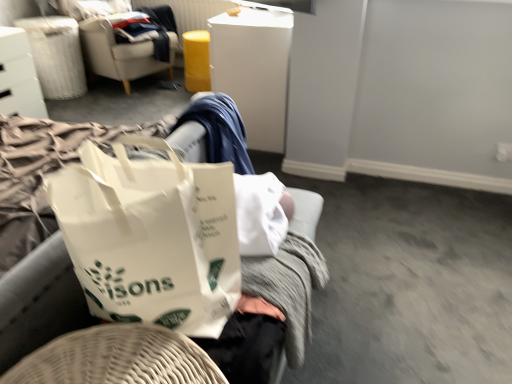
Question: Is white plastic file cabinet at upper center behind white glossy drawer at upper left, arranged as the 2th furniture when ordered from the bottom?

Choices:
 (A) no
 (B) yes

Answer: (A)

Question: Does white plastic file cabinet at upper center turn towards white glossy drawer at upper left, which appears as the 1th furniture when viewed from the left?

Choices:
 (A) yes
 (B) no

Answer: (A)

Question: Is white plastic file cabinet at upper center looking in the opposite direction of white glossy drawer at upper left, arranged as the 2th furniture when viewed from the front?

Choices:
 (A) yes
 (B) no

Answer: (B)

Question: Could white glossy drawer at upper left, the 2th furniture when ordered from right to left, be considered to be inside white plastic file cabinet at upper center?

Choices:
 (A) no
 (B) yes

Answer: (A)

Question: From the image's perspective, is white plastic file cabinet at upper center under white glossy drawer at upper left, the first furniture positioned from the back?

Choices:
 (A) yes
 (B) no

Answer: (B)

Question: Is beige fabric chair at upper left situated inside white fabric laundry basket at upper left or outside?

Choices:
 (A) inside
 (B) outside

Answer: (B)

Question: From a real-world perspective, is beige fabric chair at upper left positioned above or below white fabric laundry basket at upper left?

Choices:
 (A) above
 (B) below

Answer: (A)

Question: Looking at the image, does beige fabric chair at upper left seem bigger or smaller compared to white fabric laundry basket at upper left?

Choices:
 (A) big
 (B) small

Answer: (A)

Question: From their relative heights in the image, would you say beige fabric chair at upper left is taller or shorter than white fabric laundry basket at upper left?

Choices:
 (A) tall
 (B) short

Answer: (A)

Question: Considering the positions of white glossy drawer at upper left, the first furniture positioned from the back, and white plastic file cabinet at upper center in the image, is white glossy drawer at upper left, the first furniture positioned from the back, bigger or smaller than white plastic file cabinet at upper center?

Choices:
 (A) small
 (B) big

Answer: (A)

Question: From the image's perspective, is white glossy drawer at upper left, which is the 1th furniture from top to bottom, above or below white plastic file cabinet at upper center?

Choices:
 (A) below
 (B) above

Answer: (A)

Question: Is white glossy drawer at upper left, the 2th furniture when ordered from right to left, situated inside white plastic file cabinet at upper center or outside?

Choices:
 (A) outside
 (B) inside

Answer: (A)

Question: In the image, is white glossy drawer at upper left, arranged as the 2th furniture when viewed from the front, on the left side or the right side of white plastic file cabinet at upper center?

Choices:
 (A) right
 (B) left

Answer: (B)

Question: From a real-world perspective, is white fabric laundry basket at upper left physically located above or below beige fabric chair at upper left?

Choices:
 (A) below
 (B) above

Answer: (A)

Question: Is point 24,26 closer or farther from the camera than point 120,69?

Choices:
 (A) closer
 (B) farther

Answer: (A)